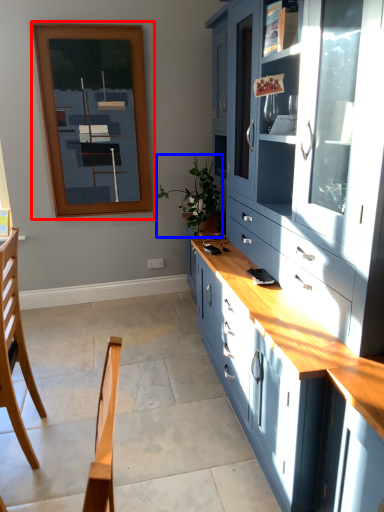
Question: Which point is further to the camera, picture frame (highlighted by a red box) or plant (highlighted by a blue box)?

Choices:
 (A) picture frame
 (B) plant

Answer: (A)